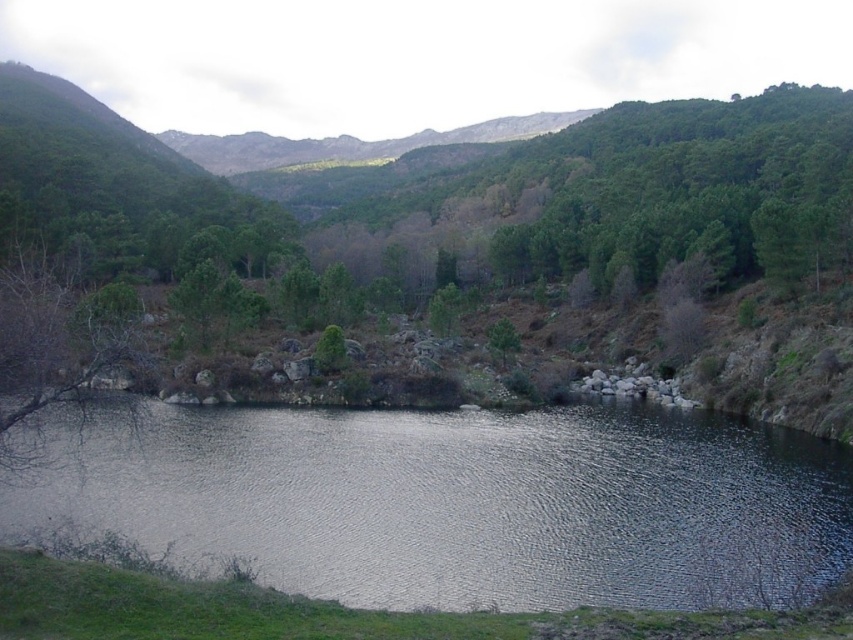
Consider the image. You are standing on the shore looking at the scene. Which object is closer to you between the reflective water at center and the green matte tree at center?

The reflective water at center is closer to you because it is in front of the green matte tree at center.

You are standing on the rocky shoreline and want to walk to the green matte tree at center. Which direction should you head relative to the reflective water at center?

You should head to the right of the reflective water at center to reach the green matte tree at center since the reflective water at center is to the left of the green matte tree at center.

You are standing at the edge of the reflective water at center in a serene landscape. If you want to take a photo of the water from a distance of 62.87 feet, where should you position yourself?

You should position yourself 62.87 feet away from the reflective water at center to take the photo.